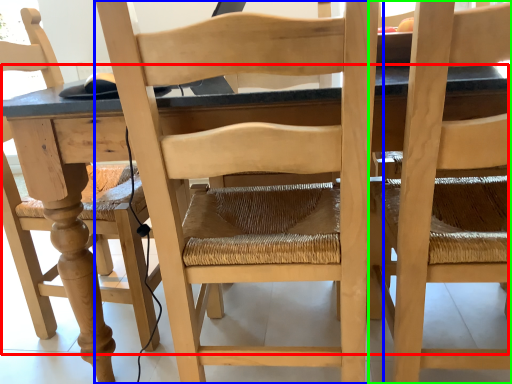
Question: Considering the real-world distances, which object is farthest from table (highlighted by a red box)? chair (highlighted by a blue box) or chair (highlighted by a green box)?

Choices:
 (A) chair
 (B) chair

Answer: (B)